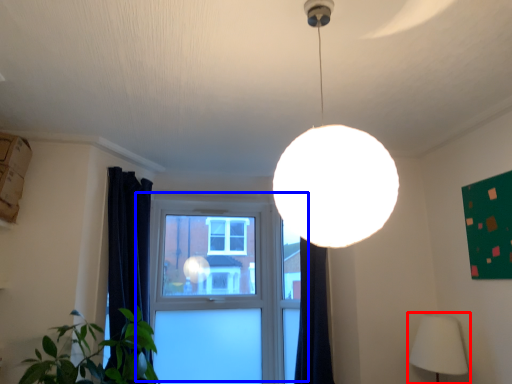
Question: Which point is further to the camera, lamp (highlighted by a red box) or window (highlighted by a blue box)?

Choices:
 (A) lamp
 (B) window

Answer: (B)